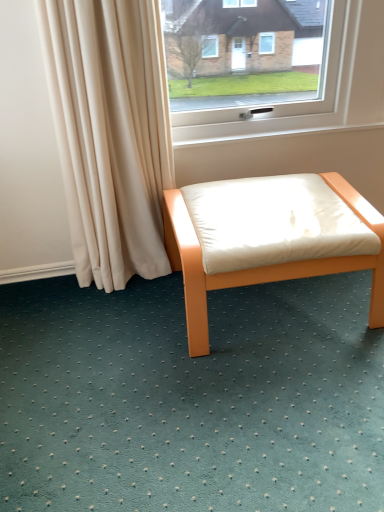
Image resolution: width=384 pixels, height=512 pixels. What are the coordinates of `free spot below matte orange stool at center (from a real-world perspective)` in the screenshot? It's located at (282, 305).